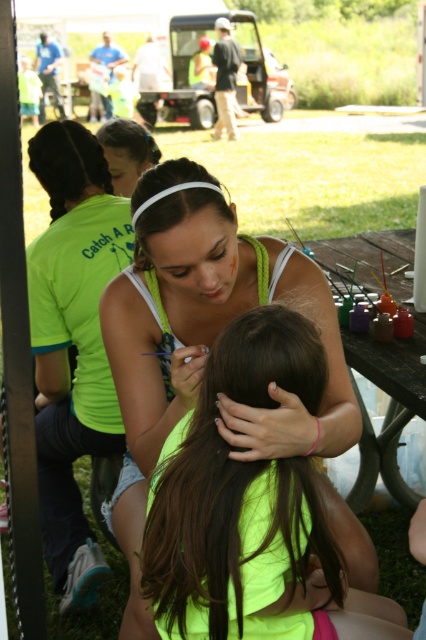
Question: Which point appears closest to the camera in this image?

Choices:
 (A) (98, 129)
 (B) (258, 358)

Answer: (B)

Question: In this image, where is neon green tank top at center located relative to dark brown hair at center?

Choices:
 (A) below
 (B) above

Answer: (A)

Question: Can you confirm if neon green tank top at center is positioned above dark brown hair at center?

Choices:
 (A) no
 (B) yes

Answer: (A)

Question: Which point appears closest to the camera in this image?

Choices:
 (A) (141, 236)
 (B) (52, 140)

Answer: (A)

Question: Which point appears farthest from the camera in this image?

Choices:
 (A) (397, 499)
 (B) (163, 163)
 (C) (325, 454)
 (D) (143, 144)

Answer: (D)

Question: Is the position of neon green tank top at center less distant than that of brown smooth hair at center?

Choices:
 (A) yes
 (B) no

Answer: (B)